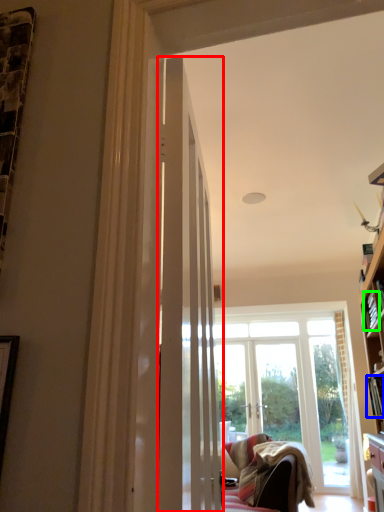
Question: Which object is positioned farthest from door (highlighted by a red box)? Select from book (highlighted by a blue box) and book (highlighted by a green box).

Choices:
 (A) book
 (B) book

Answer: (A)